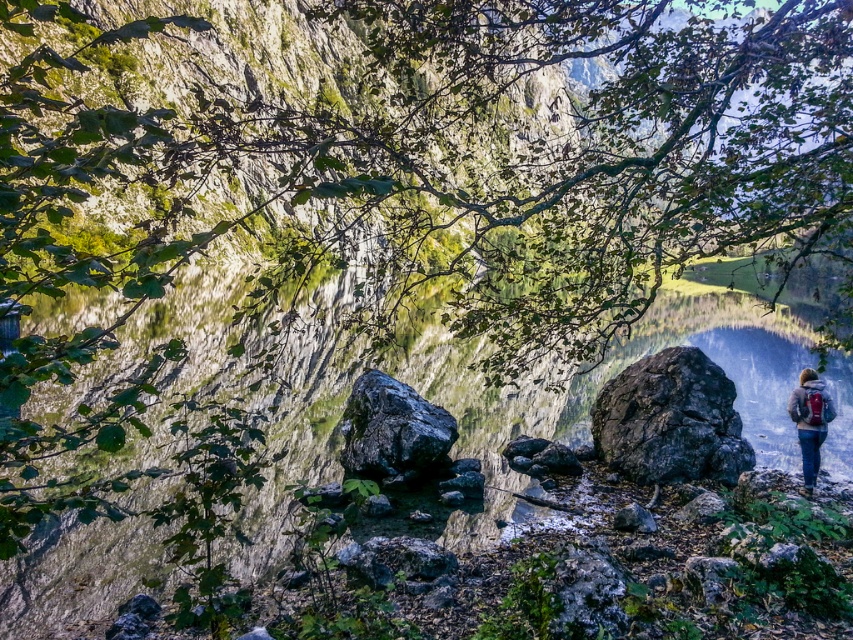
Question: Which object is positioned closest to the denim jacket at lower right?

Choices:
 (A) dark gray rock at center
 (B) black rough rock at center

Answer: (A)

Question: Does black rough rock at center appear over denim jacket at lower right?

Choices:
 (A) yes
 (B) no

Answer: (A)

Question: Which object appears closest to the camera in this image?

Choices:
 (A) dark gray rock at center
 (B) black rough rock at center
 (C) denim jacket at lower right

Answer: (C)

Question: Can you confirm if black rough rock at center is bigger than denim jacket at lower right?

Choices:
 (A) no
 (B) yes

Answer: (B)

Question: Does dark gray rock at center have a larger size compared to denim jacket at lower right?

Choices:
 (A) yes
 (B) no

Answer: (A)

Question: Which object is the farthest from the black rough rock at center?

Choices:
 (A) denim jacket at lower right
 (B) dark gray rock at center

Answer: (A)